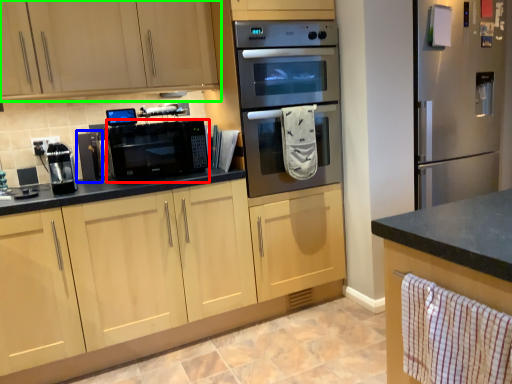
Question: Considering the real-world distances, which object is farthest from home appliance (highlighted by a red box)? appliance (highlighted by a blue box) or cabinetry (highlighted by a green box)?

Choices:
 (A) appliance
 (B) cabinetry

Answer: (B)